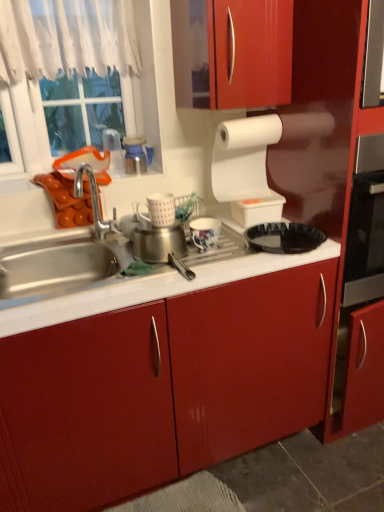
The width and height of the screenshot is (384, 512). I want to click on vacant space situated above black plastic tray at center (from a real-world perspective), so click(284, 233).